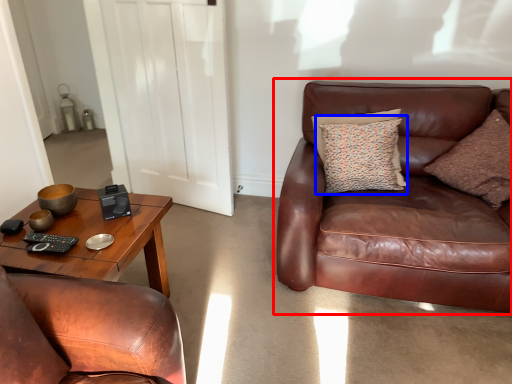
Question: Which object appears closest to the camera in this image, studio couch (highlighted by a red box) or pillow (highlighted by a blue box)?

Choices:
 (A) studio couch
 (B) pillow

Answer: (A)